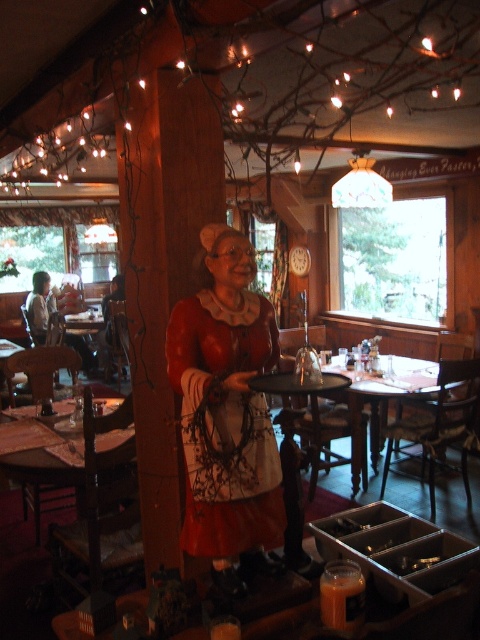
Question: Is wooden table at center to the left of wooden round table at center from the viewer's perspective?

Choices:
 (A) yes
 (B) no

Answer: (B)

Question: Which object appears closest to the camera in this image?

Choices:
 (A) matte red dress at center
 (B) wooden table at lower left
 (C) wooden round table at center

Answer: (A)

Question: Is wooden table at center positioned before wooden round table at center?

Choices:
 (A) no
 (B) yes

Answer: (A)

Question: Which point is farther to the camera?

Choices:
 (A) (71, 477)
 (B) (354, 460)
 (C) (347, 381)

Answer: (B)

Question: Which object is farther from the camera taking this photo?

Choices:
 (A) matte red dress at center
 (B) wooden table at center

Answer: (B)

Question: Is matte red dress at center to the left of wooden round table at center from the viewer's perspective?

Choices:
 (A) yes
 (B) no

Answer: (A)